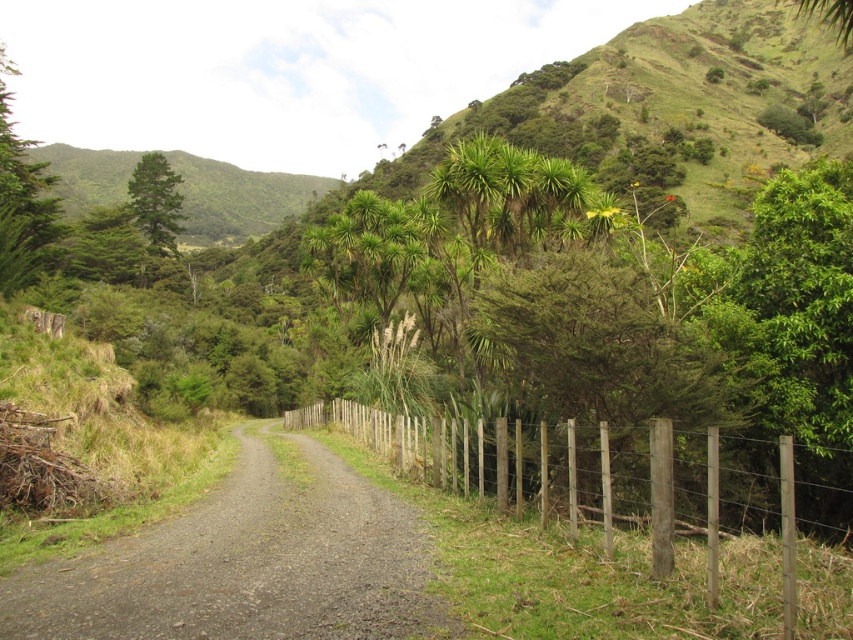
Is point (219, 486) positioned in front of point (68, 193)?

Yes, it is in front of point (68, 193).

Does gray gravel road at center have a greater height compared to green leafy hillside at upper left?

Incorrect, gray gravel road at center's height is not larger of green leafy hillside at upper left's.

Identify the location of gray gravel road at center. (245, 563).

Find the location of a particular element. The image size is (853, 640). gray gravel road at center is located at coordinates (245, 563).

Does gray gravel road at center appear under green leafy tree at left?

Yes.

How much distance is there between gray gravel road at center and green leafy tree at left?

They are 39.43 meters apart.

Which is behind, point (282, 577) or point (30, 177)?

The point (30, 177) is behind.

This screenshot has height=640, width=853. Find the location of `gray gravel road at center`. gray gravel road at center is located at coordinates (245, 563).

From the picture: Is the position of green leafy hillside at upper left more distant than that of green leafy tree at left?

Yes.

Is point (71, 182) farther from viewer compared to point (33, 230)?

Yes, it is.

Image resolution: width=853 pixels, height=640 pixels. What are the coordinates of `green leafy hillside at upper left` in the screenshot? It's located at (236, 198).